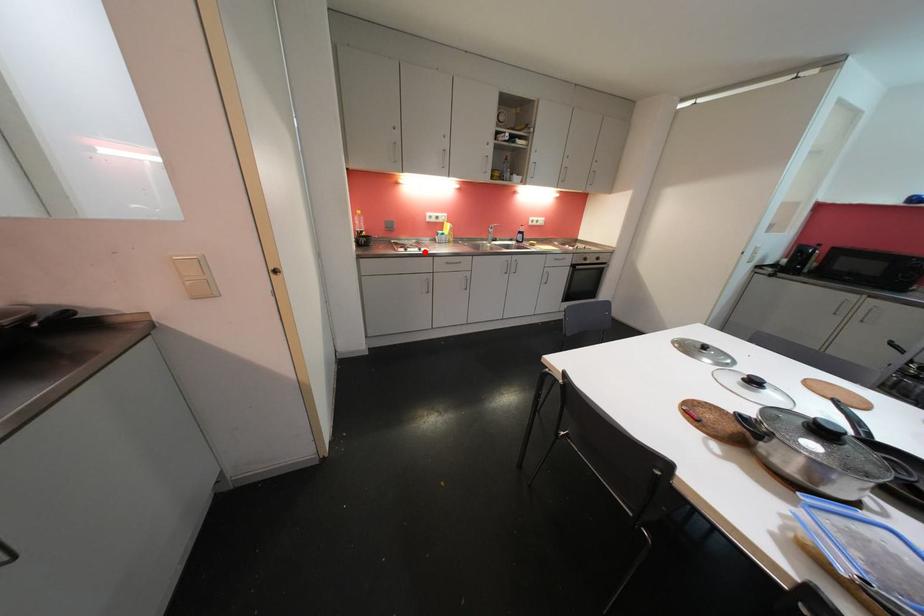
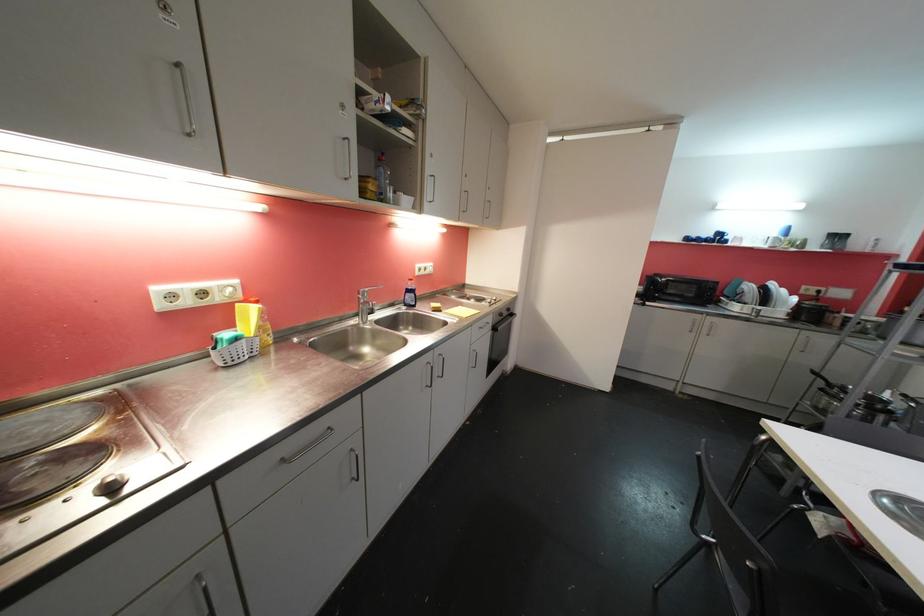
The point at the highlighted location is marked in the first image. Where is the corresponding point in the second image?

(116, 490)